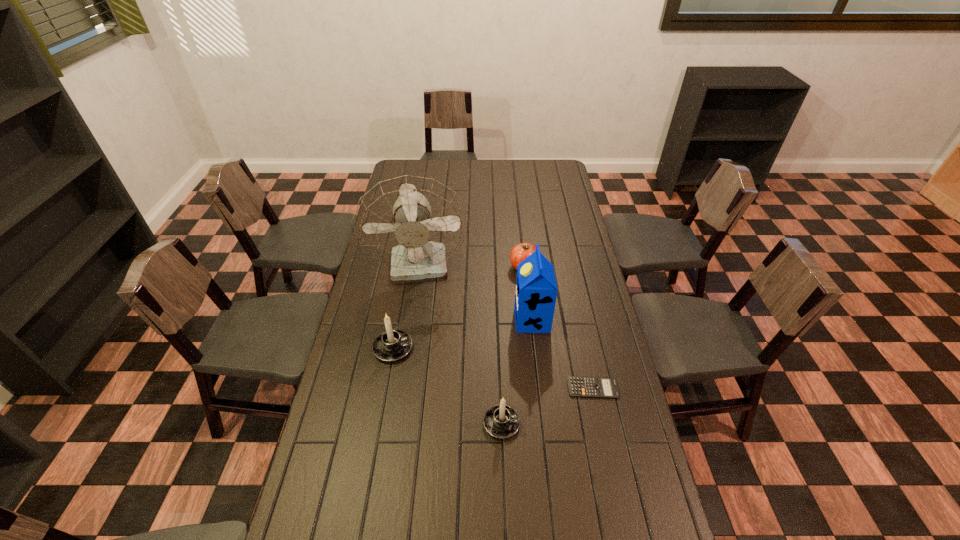
With all candle holders evenly spaced, where should an extra candle holder be placed on the right to continue the pattern? Please point out a vacant space. Please provide its 2D coordinates. Your answer should be formatted as a tuple, i.e. [(x, y)], where the tuple contains the x and y coordinates of a point satisfying the conditions above.

[(650, 527)]